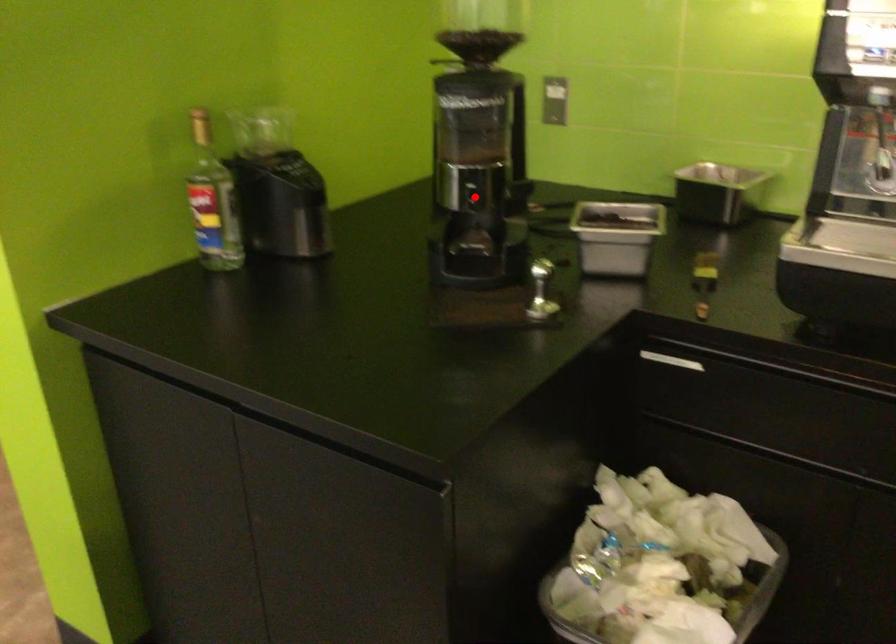
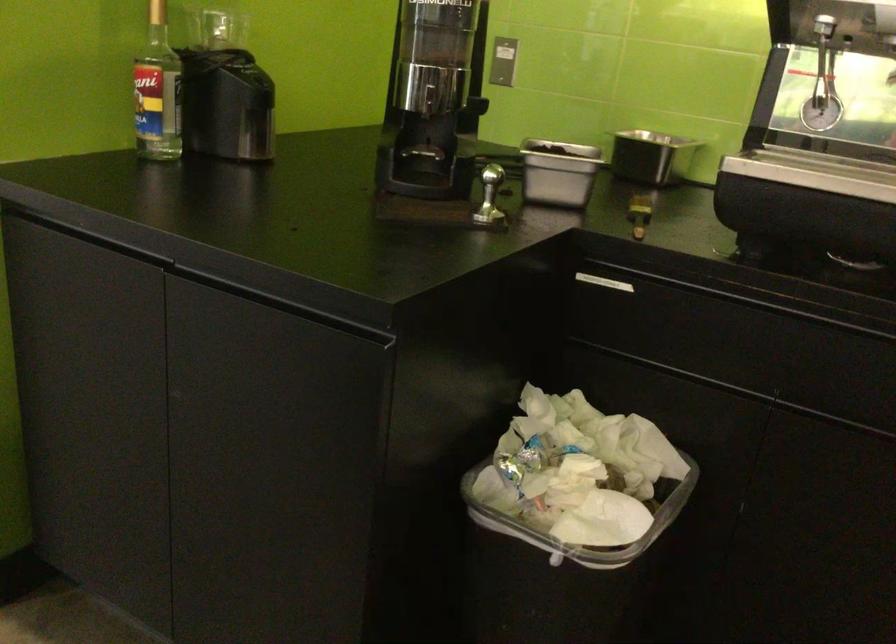
Where in the second image is the point corresponding to the highlighted location from the first image?

(433, 100)